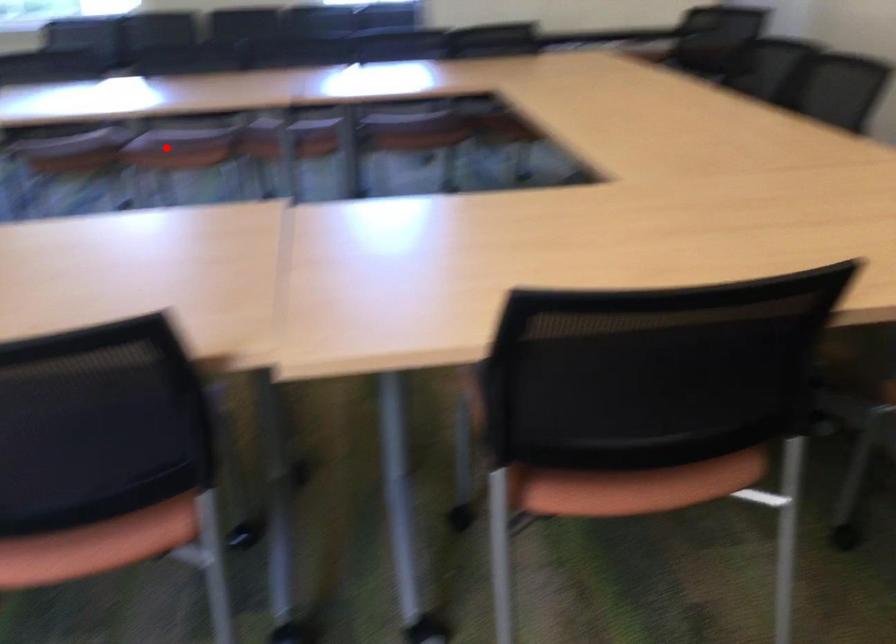
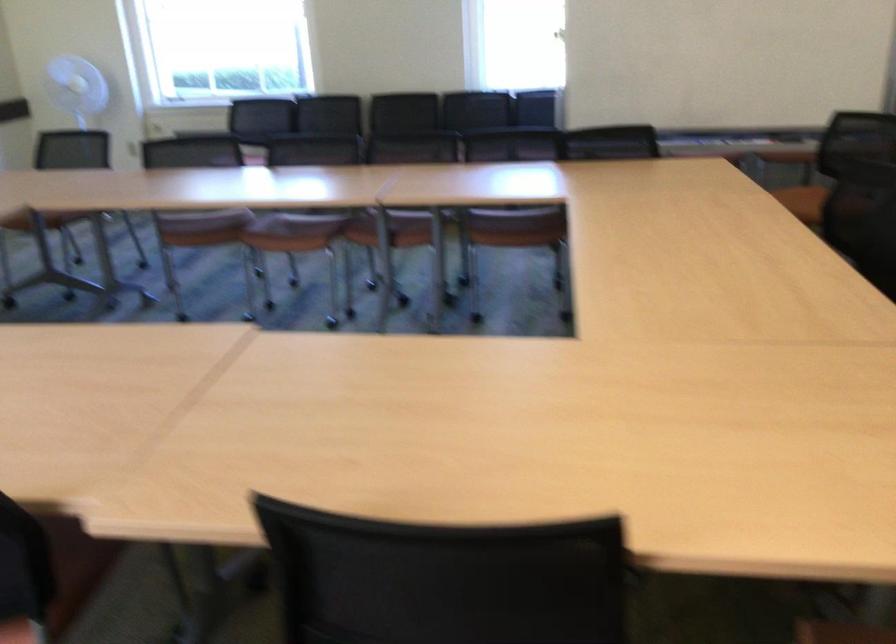
Locate, in the second image, the point that corresponds to the highlighted location in the first image.

(293, 232)